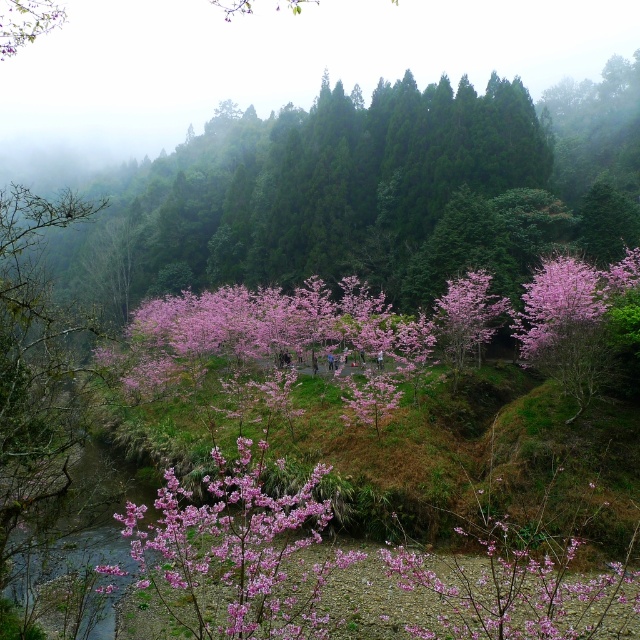
You are an artist sketching the scene and want to capture the pink matte flowers at center and the pink matte flower at center accurately. Which one should you draw larger in your sketch?

The pink matte flowers at center should be drawn larger because its width is greater than the pink matte flower at center.